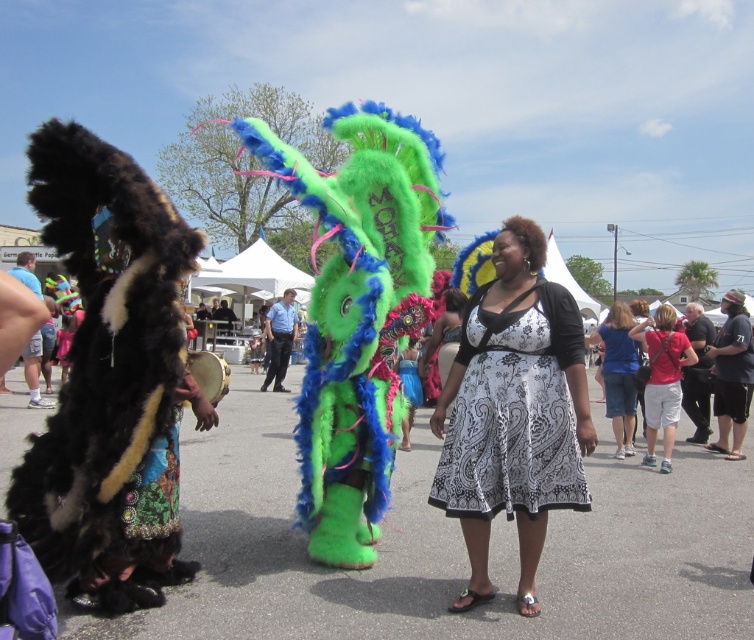
Is black cotton shirt at right below blue denim jeans at center?

Indeed, black cotton shirt at right is positioned under blue denim jeans at center.

Is black cotton shirt at right behind blue denim jeans at center?

No, black cotton shirt at right is closer to the viewer.

What do you see at coordinates (731, 374) in the screenshot?
I see `black cotton shirt at right` at bounding box center [731, 374].

I want to click on black cotton shirt at right, so click(731, 374).

Who is positioned more to the right, blue denim shorts at lower right or blue denim jeans at center?

From the viewer's perspective, blue denim shorts at lower right appears more on the right side.

Does blue denim shorts at lower right appear over blue denim jeans at center?

No.

Who is more forward, (589, 339) or (284, 339)?

Positioned in front is point (589, 339).

The height and width of the screenshot is (640, 754). What are the coordinates of `blue denim shorts at lower right` in the screenshot? It's located at (618, 372).

Is point (653, 401) farther from camera compared to point (679, 394)?

Yes, point (653, 401) is farther from viewer.

This screenshot has height=640, width=754. What do you see at coordinates (661, 380) in the screenshot? I see `white cotton shorts at lower right` at bounding box center [661, 380].

In order to click on white cotton shorts at lower right in this screenshot , I will do (661, 380).